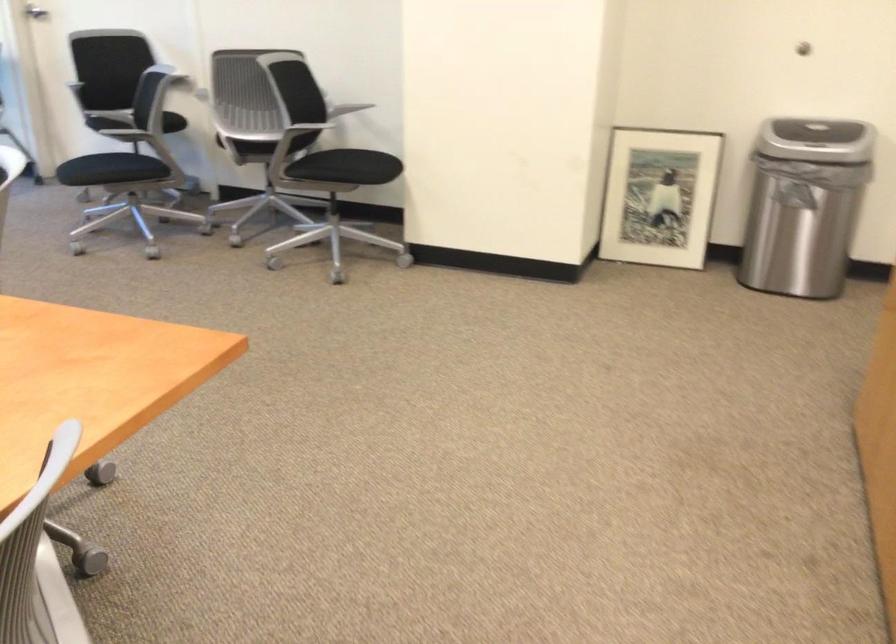
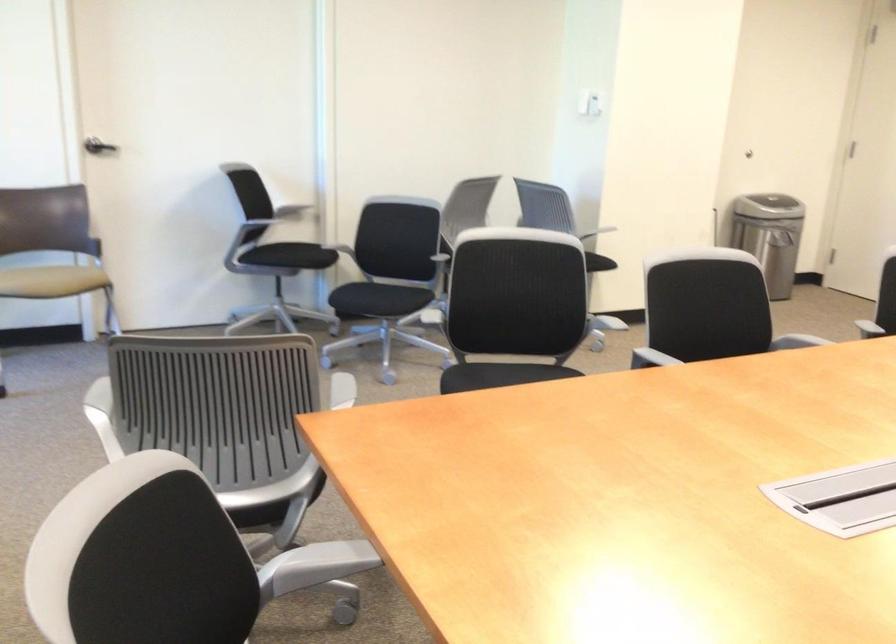
Question: I am providing you with two images of the same scene from different viewpoints. Please identify which objects are invisible in image2.

Choices:
 (A) chair armrest
 (B) white ceramic container
 (C) black chair sitting surface
 (D) trash can lid

Answer: (A)